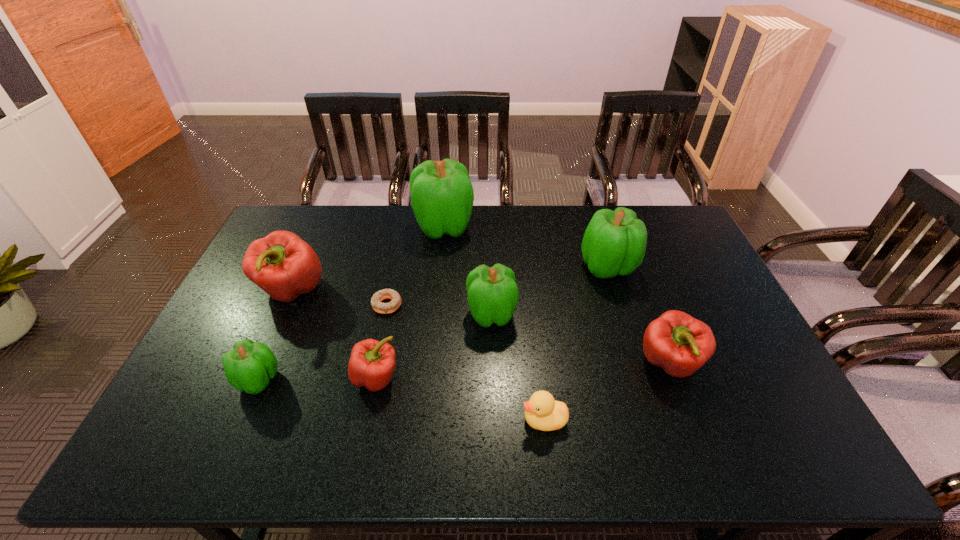
The image size is (960, 540). What are the coordinates of `vacant space situated on the back of the smallest green bell pepper` in the screenshot? It's located at (288, 313).

At what (x,y) coordinates should I click in order to perform the action: click on free space located 0.150m on the front of the smallest pink bell pepper. Please return your answer as a coordinate pair (x, y). Looking at the image, I should click on (361, 456).

Identify the location of free space located at the beak of the second shortest object. (370, 420).

The height and width of the screenshot is (540, 960). Identify the location of free region located 0.290m at the beak of the second shortest object. (402, 420).

Where is `vacant space positioned at the beak of the second shortest object`? vacant space positioned at the beak of the second shortest object is located at coordinates (456, 420).

The image size is (960, 540). Find the location of `blank space located 0.350m on the left of the shortest object`. blank space located 0.350m on the left of the shortest object is located at coordinates (258, 305).

What are the coordinates of `object that is at the far edge` in the screenshot? It's located at [442, 196].

Identify the location of object at the near edge. (542, 412).

In the image, there is a desktop. Find the location of `blank space at the far edge`. blank space at the far edge is located at coordinates [384, 233].

Locate an element on the screen. This screenshot has height=540, width=960. free space at the near edge of the desktop is located at coordinates (620, 438).